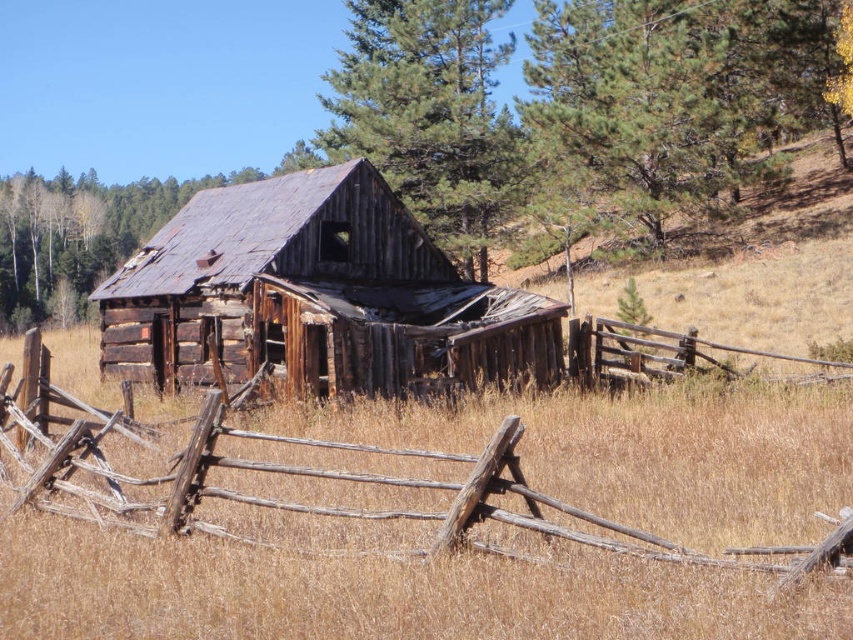
You are a painter standing in front of the weathered wood fence at center and the green rough bark tree at upper center. You want to paint both objects, but your canvas is small. Which object should you focus on to fit it entirely on your canvas?

The weathered wood fence at center occupies less space than the green rough bark tree at upper center, so you should focus on painting the weathered wood fence at center to fit it entirely on your small canvas.

You are standing in front of the rustic wooden cabin and want to take a photo that includes both point (358, 54) and point (381, 504). Based on their positions, which point should be closer to the camera in your photo?

Point (358, 54) is further to the camera than point (381, 504), so in your photo, point (358, 54) will appear closer to the camera than point (381, 504).